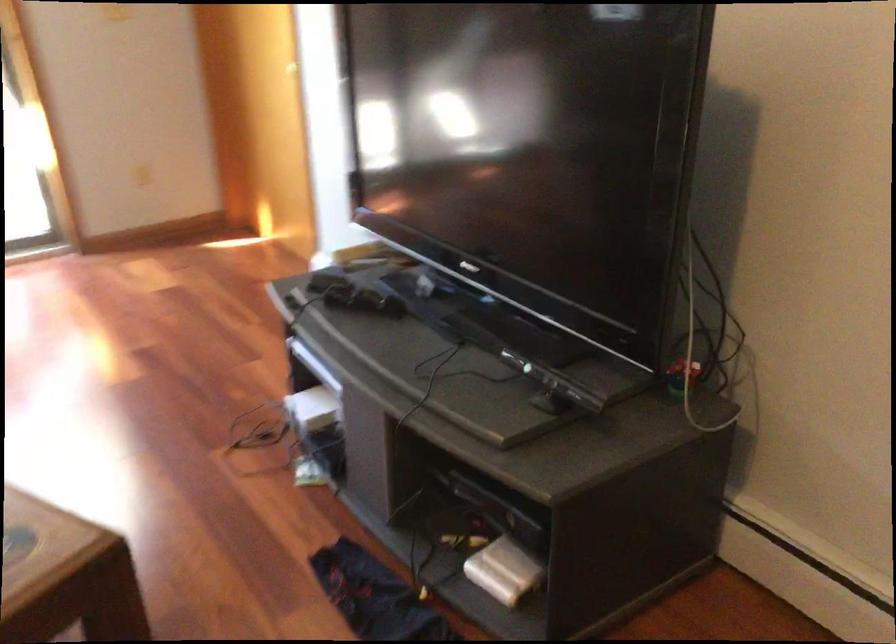
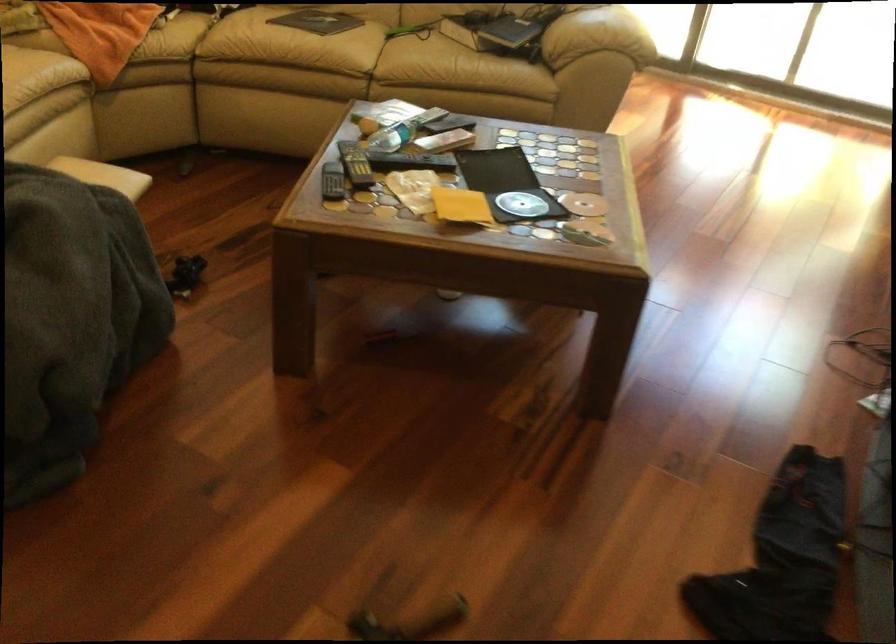
Based on the photo, the images are taken continuously from a first-person perspective. In which direction is your viewpoint rotating?

The rotation direction of the camera is left-down.